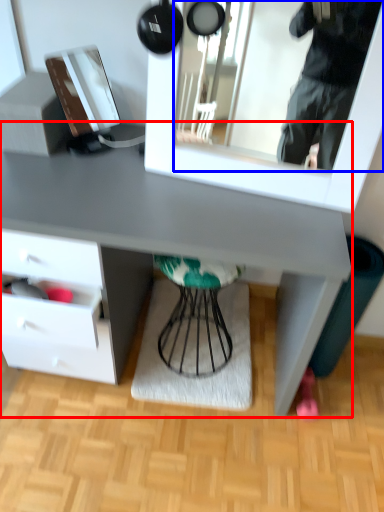
Question: Which of the following is the closest to the observer, desk (highlighted by a red box) or mirror (highlighted by a blue box)?

Choices:
 (A) desk
 (B) mirror

Answer: (B)